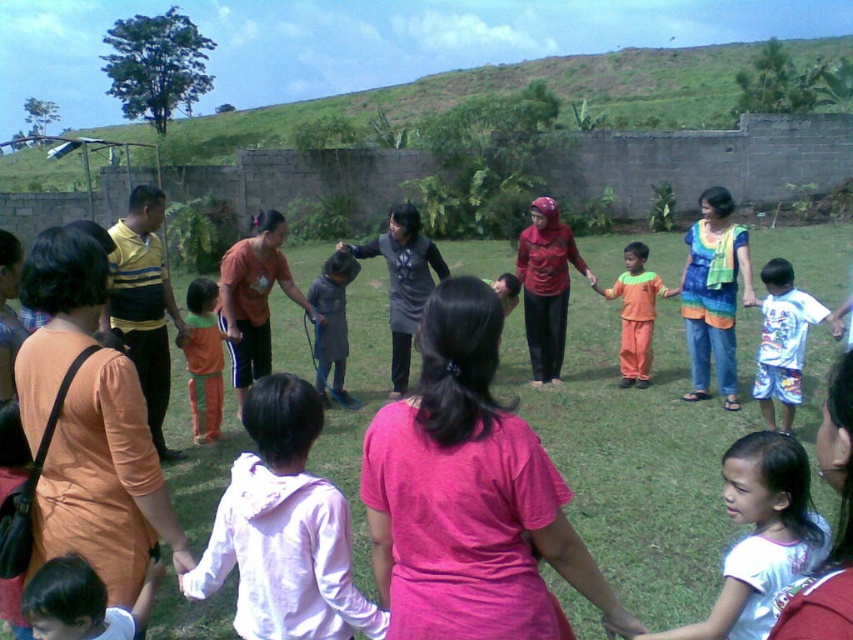
Question: Can you confirm if white cotton hoodie at center is bigger than white cotton shirt at lower left?

Choices:
 (A) yes
 (B) no

Answer: (A)

Question: Does white cotton shirt at lower right come in front of orange cotton pants at lower left?

Choices:
 (A) no
 (B) yes

Answer: (B)

Question: Based on their relative distances, which object is nearer to the orange cotton pants at lower left?

Choices:
 (A) green grass at center
 (B) dark gray fabric dress at center
 (C) white cotton hoodie at center
 (D) orange fabric dress at left

Answer: (B)

Question: Which object is farther from the camera taking this photo?

Choices:
 (A) dark gray fabric dress at center
 (B) orange fabric dress at left
 (C) orange fabric pants at center

Answer: (C)

Question: Where is white cotton shirt at lower left located in relation to dark gray fabric dress at center in the image?

Choices:
 (A) left
 (B) right

Answer: (A)

Question: Estimate the real-world distances between objects in this image. Which object is farther from the orange cotton pants at lower left?

Choices:
 (A) white printed shorts at right
 (B) orange fabric pants at center

Answer: (A)